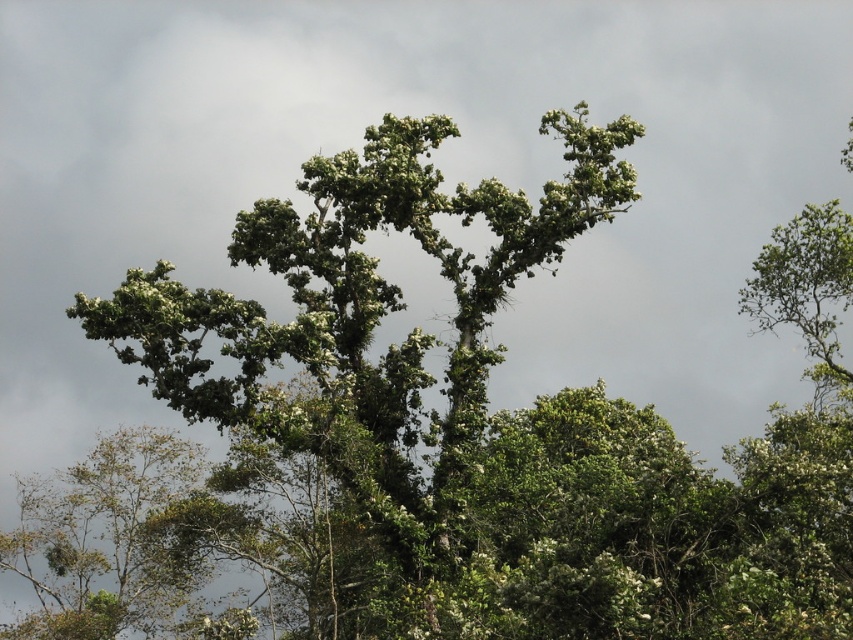
You are an observer standing in the forest looking at the two green leafy trees. Which tree is closer to you, the green leafy tree at center or the green leafy tree at upper center?

The green leafy tree at center is closer to you because it is in front of the green leafy tree at upper center.

You are a bird flying through the forest and want to land on a tree. You see the green leafy tree at center and the green leafy tree at upper center. Which tree is directly above the other?

The green leafy tree at upper center is directly above the green leafy tree at center.